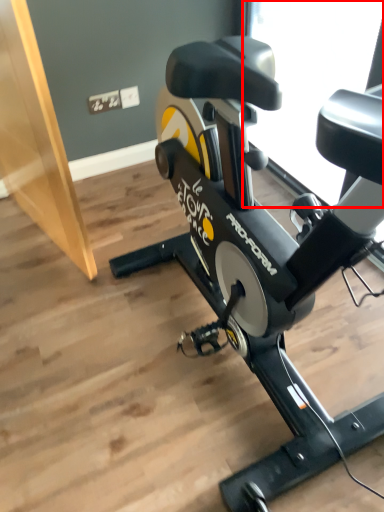
Question: Where is window screen (annotated by the red box) located in relation to stationary bicycle in the image?

Choices:
 (A) right
 (B) left

Answer: (A)